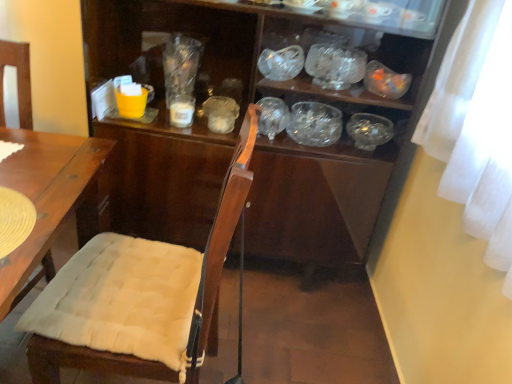
Question: In terms of width, does transparent plastic cup at upper center look wider or thinner when compared to clear glass bowl at upper center, the 3th tableware viewed from the left?

Choices:
 (A) wide
 (B) thin

Answer: (B)

Question: Is transparent plastic cup at upper center spatially inside clear glass bowl at upper center, which is the second tableware from right to left, or outside of it?

Choices:
 (A) outside
 (B) inside

Answer: (A)

Question: Which of these objects is positioned farthest from the transparent plastic cup at upper center?

Choices:
 (A) matte yellow cup at upper left, the fourth tableware from the right
 (B) transparent glass bowl at center, acting as the first tableware starting from the right
 (C) clear glass bowl at upper center, the 3th tableware viewed from the left
 (D) transparent glass bowl at upper center, positioned as the 2th glass bowl in bottom-to-top order
 (E) white glossy cup at center, the 3th tableware when ordered from right to left

Answer: (B)

Question: Estimate the real-world distances between objects in this image. Which object is closer to the white glossy cup at center, the 2th tableware positioned from the left?

Choices:
 (A) transparent glass bowl at center, positioned as the 2th glass bowl in top-to-bottom order
 (B) matte yellow cup at upper left, which is the first tableware from left to right
 (C) transparent glass bowl at upper center, positioned as the 2th glass bowl in bottom-to-top order
 (D) wooden chair cushion at center
 (E) clear glass bowl at upper center, which is the second tableware from right to left

Answer: (B)